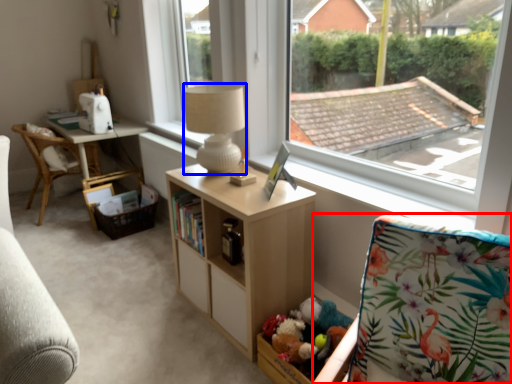
Question: Which object appears farthest to the camera in this image, rocking chair (highlighted by a red box) or lamp (highlighted by a blue box)?

Choices:
 (A) rocking chair
 (B) lamp

Answer: (B)